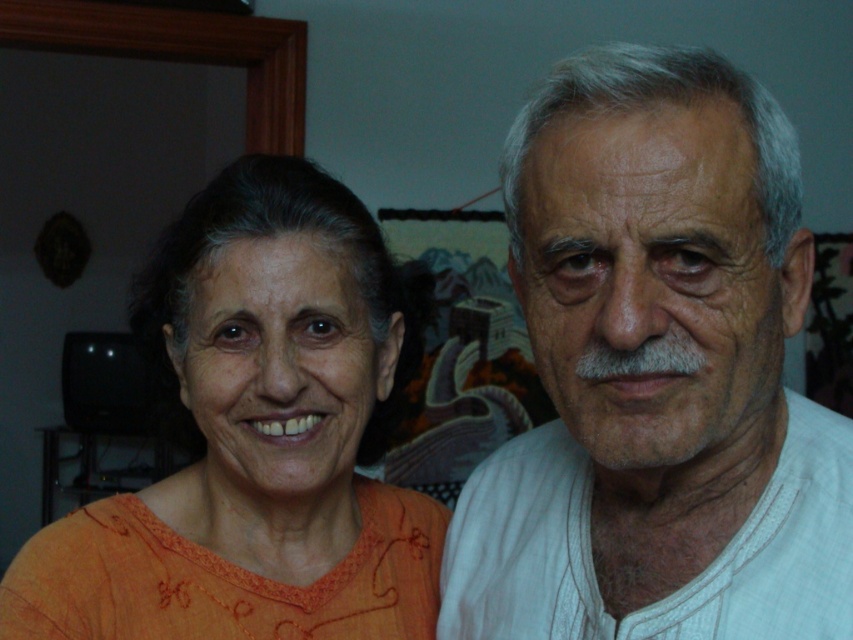
Question: Which object appears farthest from the camera in this image?

Choices:
 (A) white cotton shirt at right
 (B) orange embroidered top at left

Answer: (B)

Question: Can you confirm if white cotton shirt at right is wider than orange embroidered top at left?

Choices:
 (A) no
 (B) yes

Answer: (A)

Question: Can you confirm if white cotton shirt at right is positioned above orange embroidered top at left?

Choices:
 (A) no
 (B) yes

Answer: (A)

Question: Among these objects, which one is nearest to the camera?

Choices:
 (A) orange embroidered top at left
 (B) white cotton shirt at right

Answer: (B)

Question: Which point is closer to the camera?

Choices:
 (A) orange embroidered top at left
 (B) white cotton shirt at right

Answer: (B)

Question: Considering the relative positions of white cotton shirt at right and orange embroidered top at left in the image provided, where is white cotton shirt at right located with respect to orange embroidered top at left?

Choices:
 (A) left
 (B) right

Answer: (B)